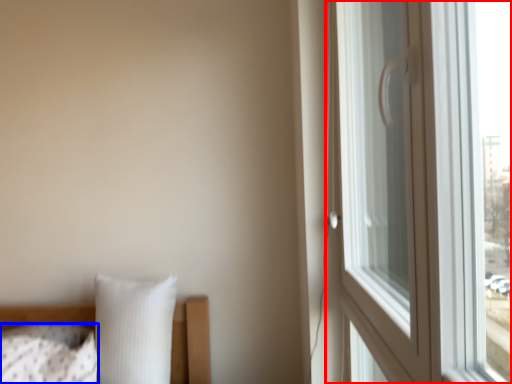
Question: Among these objects, which one is farthest to the camera, window (highlighted by a red box) or pillow (highlighted by a blue box)?

Choices:
 (A) window
 (B) pillow

Answer: (B)